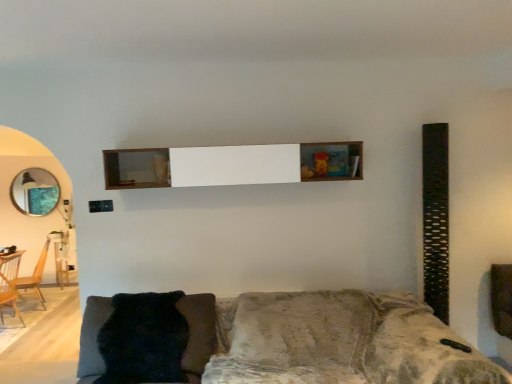
Question: Is wooden armchair at left, the first armchair when ordered from front to back, behind velvet-like gray couch at lower center?

Choices:
 (A) yes
 (B) no

Answer: (A)

Question: From the image's perspective, does wooden armchair at left, the first armchair when ordered from front to back, appear lower than velvet-like gray couch at lower center?

Choices:
 (A) yes
 (B) no

Answer: (A)

Question: Is wooden armchair at left, which is counted as the 2th armchair, starting from the back, closer to camera compared to velvet-like gray couch at lower center?

Choices:
 (A) yes
 (B) no

Answer: (B)

Question: Is wooden armchair at left, the first armchair when ordered from front to back, positioned beyond the bounds of velvet-like gray couch at lower center?

Choices:
 (A) yes
 (B) no

Answer: (A)

Question: From a real-world perspective, is wooden armchair at left, which is counted as the 2th armchair, starting from the back, on velvet-like gray couch at lower center?

Choices:
 (A) no
 (B) yes

Answer: (A)

Question: From a real-world perspective, is wooden armchair at left, marked as the 1th armchair in a back-to-front arrangement, positioned above or below velvet-like gray couch at lower center?

Choices:
 (A) below
 (B) above

Answer: (A)

Question: Is wooden armchair at left, marked as the 1th armchair in a back-to-front arrangement, to the left or to the right of velvet-like gray couch at lower center in the image?

Choices:
 (A) right
 (B) left

Answer: (B)

Question: In terms of width, does wooden armchair at left, marked as the 1th armchair in a back-to-front arrangement, look wider or thinner when compared to velvet-like gray couch at lower center?

Choices:
 (A) thin
 (B) wide

Answer: (A)

Question: Relative to velvet-like gray couch at lower center, is wooden armchair at left, which ranks as the second armchair in front-to-back order, in front or behind?

Choices:
 (A) front
 (B) behind

Answer: (B)

Question: In the image, is velvet-like gray couch at lower center on the left side or the right side of wooden shelf at center?

Choices:
 (A) right
 (B) left

Answer: (A)

Question: Do you think velvet-like gray couch at lower center is within wooden shelf at center, or outside of it?

Choices:
 (A) outside
 (B) inside

Answer: (A)

Question: Based on their sizes in the image, would you say velvet-like gray couch at lower center is bigger or smaller than wooden shelf at center?

Choices:
 (A) small
 (B) big

Answer: (B)

Question: From their relative heights in the image, would you say velvet-like gray couch at lower center is taller or shorter than wooden shelf at center?

Choices:
 (A) short
 (B) tall

Answer: (B)

Question: Considering the positions of wooden shelf at center and wooden armchair at left, which ranks as the second armchair in front-to-back order, in the image, is wooden shelf at center wider or thinner than wooden armchair at left, which ranks as the second armchair in front-to-back order,?

Choices:
 (A) thin
 (B) wide

Answer: (A)

Question: From the image's perspective, is wooden shelf at center located above or below wooden armchair at left, which ranks as the second armchair in front-to-back order?

Choices:
 (A) above
 (B) below

Answer: (A)